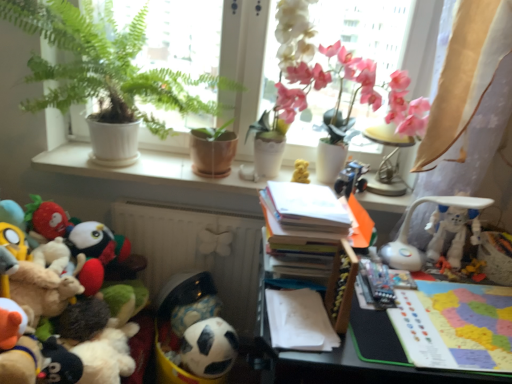
Question: Is white ceramic pots at upper center wider or thinner than fluffy plush toys at left, which appears as the 6th toy when viewed from the right?

Choices:
 (A) wide
 (B) thin

Answer: (B)

Question: From their relative heights in the image, would you say white ceramic pots at upper center is taller or shorter than fluffy plush toys at left, which appears as the 6th toy when viewed from the right?

Choices:
 (A) tall
 (B) short

Answer: (B)

Question: Which object is positioned closest to the beige sheer curtain at upper right?

Choices:
 (A) smooth plastic table at lower right
 (B) metallic blue robot at center, positioned as the 3th toy in right-to-left order
 (C) white paper at center
 (D) white ceramic pots at upper center
 (E) white plastic robot at right, the fifth toy when ordered from left to right

Answer: (E)

Question: Estimate the real-world distances between objects in this image. Which object is closer to the white paper book at center, the first book from the left?

Choices:
 (A) white ceramic vase at upper center, positioned as the 1th houseplant in right-to-left order
 (B) fluffy plush toys at left, which ranks as the first toy in left-to-right order
 (C) matte brown pot at center
 (D) beige sheer curtain at upper right
 (E) multicolored paper map at right, which is the first book in bottom-to-top order

Answer: (E)